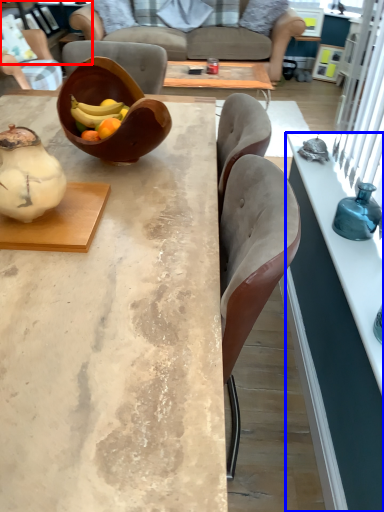
Question: Which object appears farthest to the camera in this image, cabinetry (highlighted by a red box) or desk (highlighted by a blue box)?

Choices:
 (A) cabinetry
 (B) desk

Answer: (A)